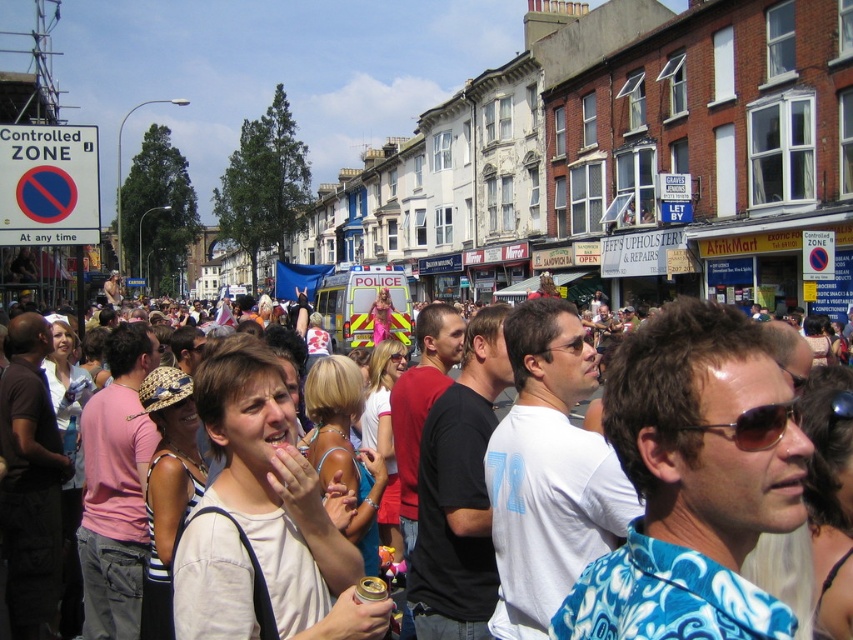
Question: Does white cotton shirt at center have a smaller size compared to sunglasses at center?

Choices:
 (A) no
 (B) yes

Answer: (A)

Question: Is white cotton shirt at center wider than sunglasses at center?

Choices:
 (A) no
 (B) yes

Answer: (B)

Question: Can you confirm if white cotton shirt at center is thinner than sunglasses at center?

Choices:
 (A) no
 (B) yes

Answer: (A)

Question: Which point is closer to the camera?

Choices:
 (A) white cotton shirt at center
 (B) sunglasses at center

Answer: (A)